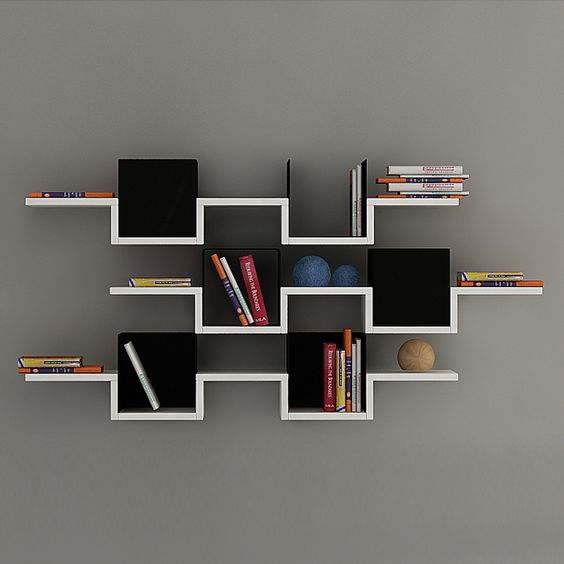
Where is `books on bottom shelve`? books on bottom shelve is located at coordinates (63, 362), (67, 369), (139, 371), (328, 369), (338, 372), (347, 358), (351, 365), (356, 360).